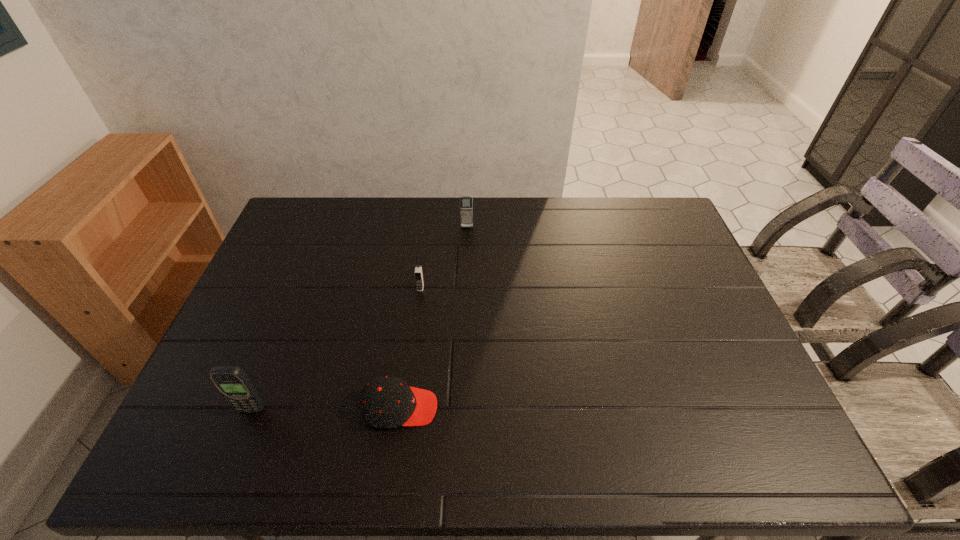
Locate an element on the screen. This screenshot has height=540, width=960. object that is the second nearest to the rightmost object is located at coordinates (387, 402).

Locate which object is the second closest to the cap. Please provide its 2D coordinates. Your answer should be formatted as a tuple, i.e. [(x, y)], where the tuple contains the x and y coordinates of a point satisfying the conditions above.

[(418, 272)]

You are a GUI agent. You are given a task and a screenshot of the screen. Output one action in this format:
    pyautogui.click(x=<x>, y=<y>)
    Task: Click on the cellular telephone that stands as the third closest to the cap
    This screenshot has height=540, width=960.
    Given the screenshot: What is the action you would take?
    pyautogui.click(x=466, y=203)

Locate which cellular telephone ranks in proximity to the farthest cellular telephone. Please provide its 2D coordinates. Your answer should be formatted as a tuple, i.e. [(x, y)], where the tuple contains the x and y coordinates of a point satisfying the conditions above.

[(418, 272)]

Identify the location of free space that satisfies the following two spatial constraints: 1. on the front-facing side of the farthest cellular telephone; 2. on the front-facing side of the cap. The height and width of the screenshot is (540, 960). (461, 408).

I want to click on vacant space that satisfies the following two spatial constraints: 1. on the front-facing side of the farthest object; 2. on the front-facing side of the cap, so click(461, 408).

Where is `vacant region that satisfies the following two spatial constraints: 1. on the front-facing side of the farthest object; 2. on the front-facing side of the cap`? This screenshot has height=540, width=960. vacant region that satisfies the following two spatial constraints: 1. on the front-facing side of the farthest object; 2. on the front-facing side of the cap is located at coordinates (461, 408).

The image size is (960, 540). Find the location of `blank area in the image that satisfies the following two spatial constraints: 1. on the front-facing side of the farthest cellular telephone; 2. on the front-facing side of the shortest object`. blank area in the image that satisfies the following two spatial constraints: 1. on the front-facing side of the farthest cellular telephone; 2. on the front-facing side of the shortest object is located at coordinates (461, 408).

At what (x,y) coordinates should I click in order to perform the action: click on vacant area that satisfies the following two spatial constraints: 1. on the front-facing side of the rightmost object; 2. on the front-facing side of the cap. Please return your answer as a coordinate pair (x, y). The height and width of the screenshot is (540, 960). Looking at the image, I should click on (461, 408).

In order to click on free space that satisfies the following two spatial constraints: 1. on the front-facing side of the shortest object; 2. on the screen of the leftmost cellular telephone in this screenshot , I will do `click(400, 409)`.